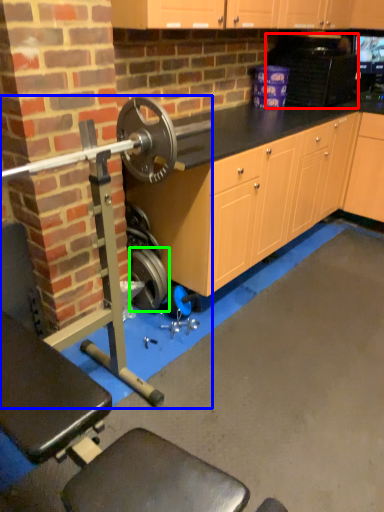
Question: Considering the real-world distances, which object is farthest from appliance (highlighted by a red box)? barbell (highlighted by a blue box) or wheel (highlighted by a green box)?

Choices:
 (A) barbell
 (B) wheel

Answer: (B)